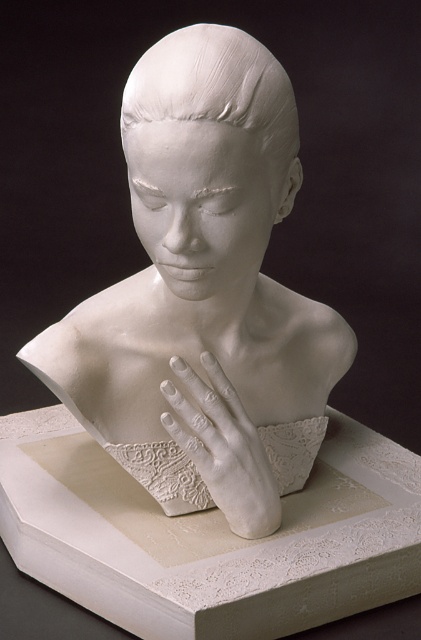
Can you confirm if white matte bust at center is positioned above white matte hand at center?

Indeed, white matte bust at center is positioned over white matte hand at center.

Is point (234, 458) closer to viewer compared to point (208, 428)?

No, it is not.

What do you see at coordinates (204, 291) in the screenshot?
I see `white matte bust at center` at bounding box center [204, 291].

I want to click on white matte bust at center, so click(204, 291).

Does white matte bust at center have a greater height compared to white matte sculpture at center?

Yes.

Who is lower down, white matte bust at center or white matte sculpture at center?

white matte bust at center is lower down.

What do you see at coordinates (204, 291) in the screenshot? This screenshot has height=640, width=421. I see `white matte bust at center` at bounding box center [204, 291].

Where is `white matte bust at center`? white matte bust at center is located at coordinates (204, 291).

Can you confirm if white matte sculpture at center is positioned to the left of white matte hand at center?

Indeed, white matte sculpture at center is positioned on the left side of white matte hand at center.

Measure the distance from white matte sculpture at center to white matte hand at center.

The distance of white matte sculpture at center from white matte hand at center is 11.16 inches.

Which is in front, point (274, 129) or point (199, 400)?

Point (274, 129) is in front.

Locate an element on the screen. white matte sculpture at center is located at coordinates (215, 90).